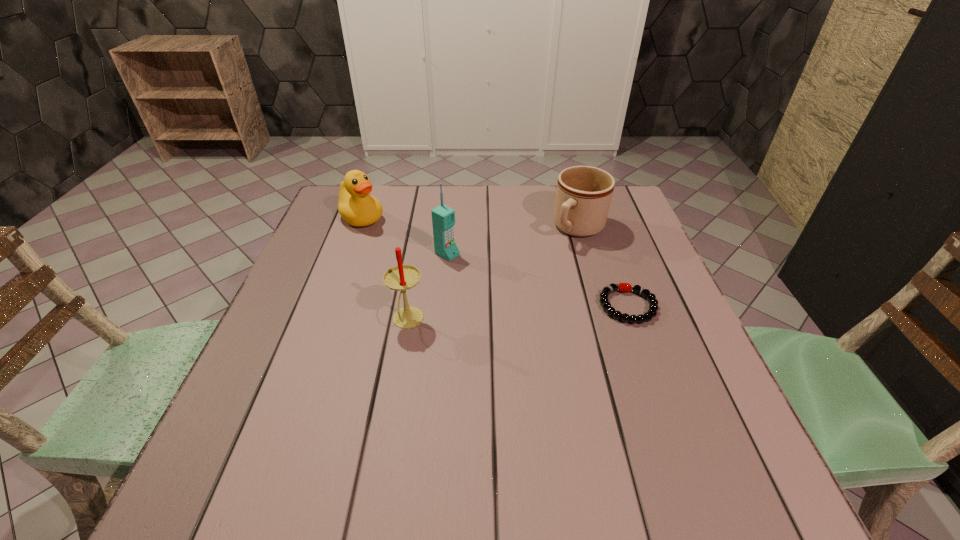
At what (x,y) coordinates should I click in order to perform the action: click on the second object from left to right. Please return your answer as a coordinate pair (x, y). The image size is (960, 540). Looking at the image, I should click on (402, 277).

Image resolution: width=960 pixels, height=540 pixels. What are the coordinates of `the shortest object` in the screenshot? It's located at (622, 287).

Identify the location of the leftmost object. (356, 206).

The width and height of the screenshot is (960, 540). Identify the location of mug. (583, 195).

This screenshot has height=540, width=960. Find the location of `the third object from left to right`. the third object from left to right is located at coordinates (443, 218).

Locate an element on the screen. vacant region located on the back of the second object from left to right is located at coordinates (420, 252).

The image size is (960, 540). Identify the location of free region located on the back of the shortest object. (603, 236).

At what (x,y) coordinates should I click in order to perform the action: click on free region located at the beak of the duck. Please return your answer as a coordinate pair (x, y). Image resolution: width=960 pixels, height=540 pixels. Looking at the image, I should click on (387, 237).

Where is `free space located 0.220m at the beak of the duck`? free space located 0.220m at the beak of the duck is located at coordinates (424, 263).

Find the location of `blank space located 0.340m at the beak of the duck`. blank space located 0.340m at the beak of the duck is located at coordinates (455, 286).